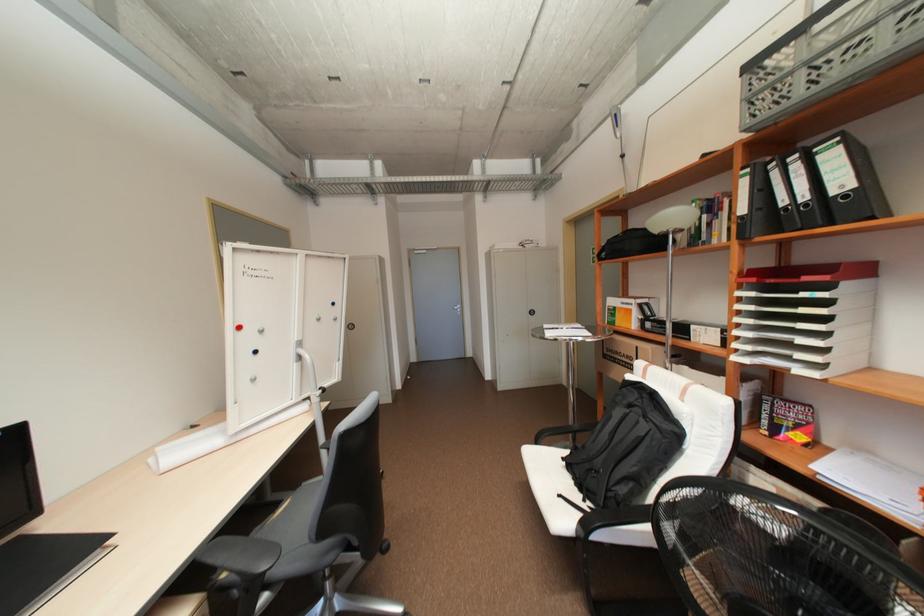
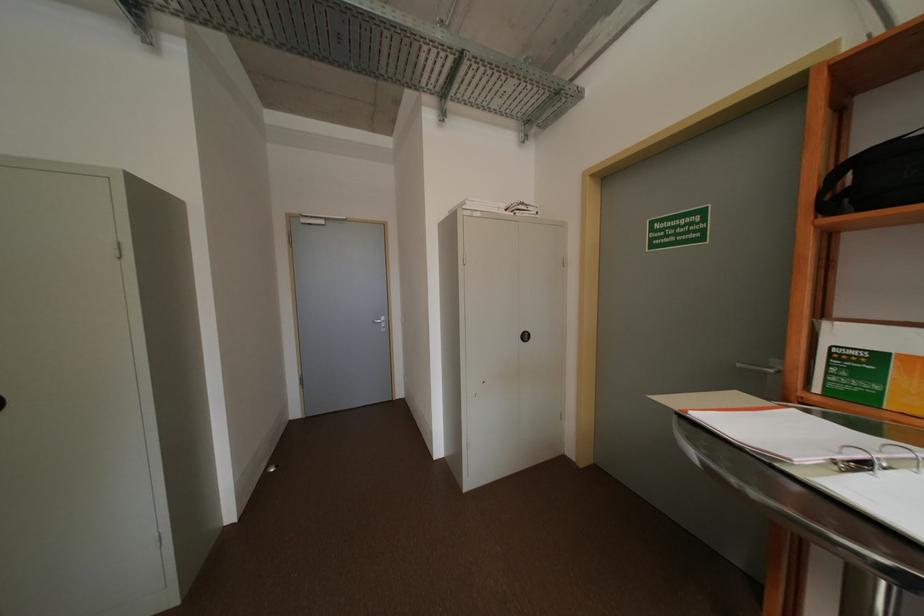
Question: What movement of the cameraman would produce the second image?

Choices:
 (A) Left
 (B) Right
 (C) Forward
 (D) Backward

Answer: (C)